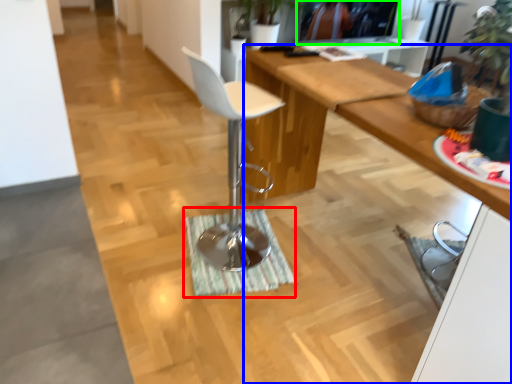
Question: Based on their relative distances, which object is nearer to doormat (highlighted by a red box)? Choose from desk (highlighted by a blue box) and television (highlighted by a green box).

Choices:
 (A) desk
 (B) television

Answer: (A)